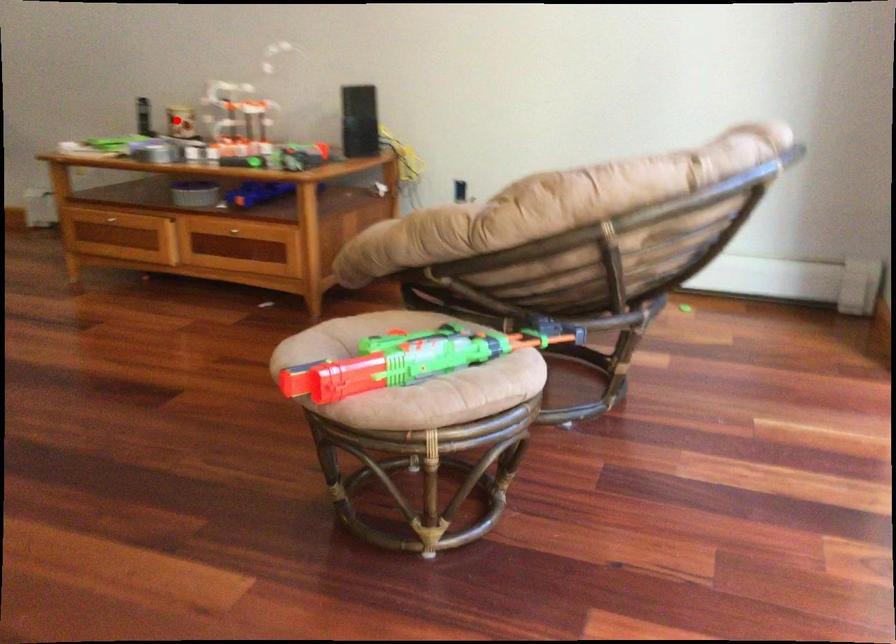
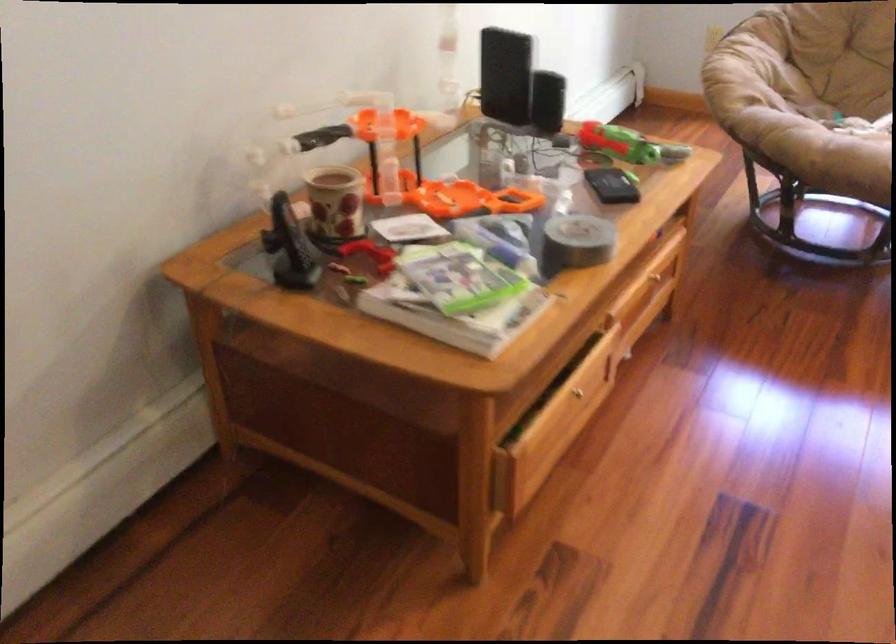
Question: I am providing you with two images of the same scene from different viewpoints. Given a red point in image1, look at the same physical point in image2. Is it:

Choices:
 (A) Closer to the viewpoint
 (B) Farther from the viewpoint

Answer: (A)